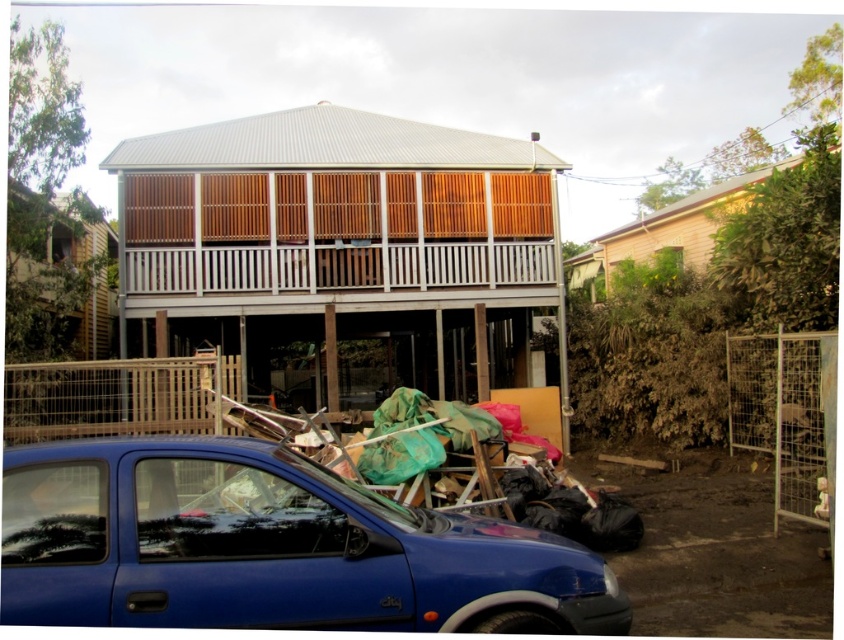
You are a delivery person trying to park your truck next to the blue matte car at lower left and the green fabric at lower center. Based on their sizes, which object should you avoid placing your truck near to ensure enough space?

The blue matte car at lower left is smaller than the green fabric at lower center, so you should avoid placing your truck near the green fabric at lower center to ensure enough space because it occupies more area.

You are standing at the point marked by coordinates point [269,547] in the image. What object are you currently standing on?

You are standing on the blue matte car at lower left, which is represented by point [269,547].